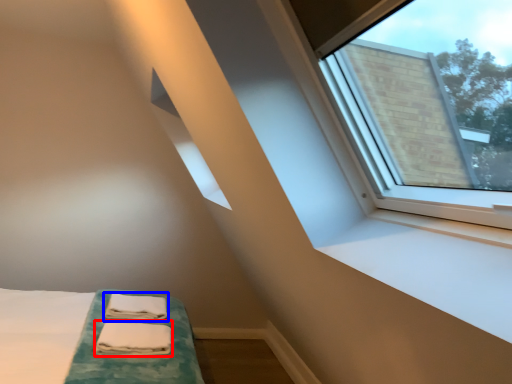
Question: Among these objects, which one is nearest to the camera, sheet (highlighted by a red box) or bath towel (highlighted by a blue box)?

Choices:
 (A) sheet
 (B) bath towel

Answer: (A)